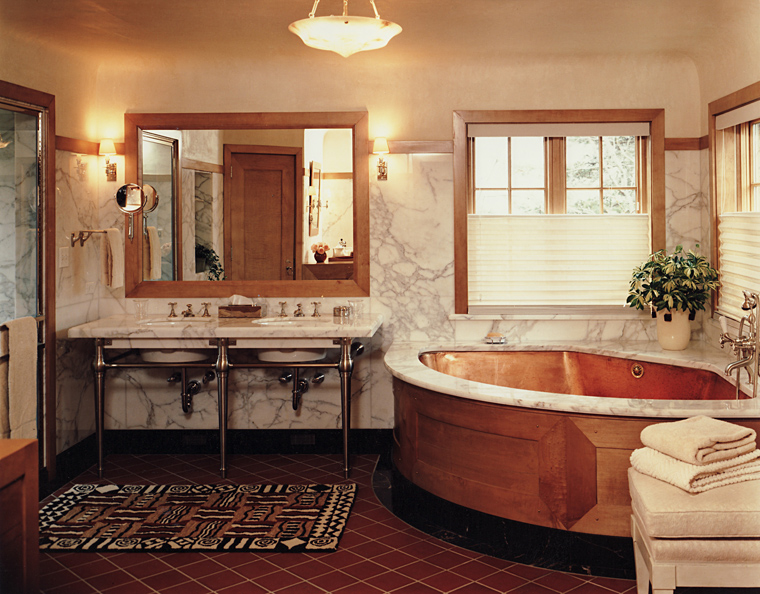
Identify the location of vase. This screenshot has height=594, width=760. [673, 339].